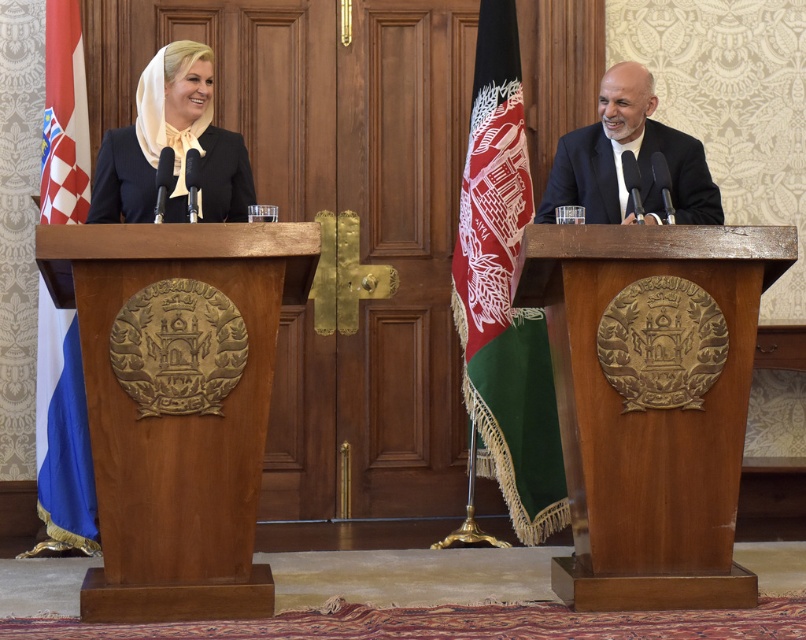
Question: Which of these objects is positioned farthest from the smooth black suit at right?

Choices:
 (A) wooden podium at center
 (B) red fabric flag at right
 (C) matte black dress at left

Answer: (C)

Question: Does red fabric flag at right have a greater width compared to smooth black suit at right?

Choices:
 (A) yes
 (B) no

Answer: (B)

Question: Estimate the real-world distances between objects in this image. Which object is farther from the red fabric flag at right?

Choices:
 (A) smooth black suit at right
 (B) white and blue fabric flag at left
 (C) matte black dress at left
 (D) wooden podium at center

Answer: (B)

Question: Does red fabric flag at right appear on the right side of white and blue fabric flag at left?

Choices:
 (A) yes
 (B) no

Answer: (A)

Question: Which of these objects is positioned farthest from the smooth black suit at right?

Choices:
 (A) wooden podium at left
 (B) white and blue fabric flag at left

Answer: (B)

Question: Does red fabric flag at right lie behind matte black dress at left?

Choices:
 (A) yes
 (B) no

Answer: (A)